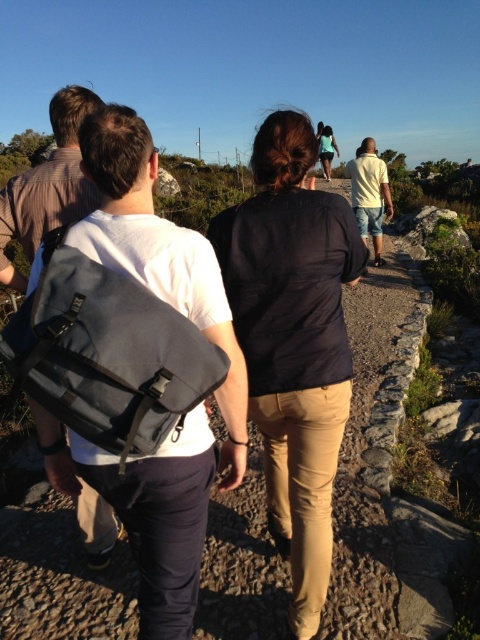
Can you confirm if black fabric shirt at center is positioned below yellow cotton shirt at center?

Correct, black fabric shirt at center is located below yellow cotton shirt at center.

Consider the image. Which of these two, black fabric shirt at center or yellow cotton shirt at center, stands shorter?

Standing shorter between the two is black fabric shirt at center.

Is point (240, 314) less distant than point (381, 230)?

Yes, point (240, 314) is in front of point (381, 230).

I want to click on black fabric shirt at center, so click(294, 340).

Who is more forward, (359, 248) or (147, 172)?

Point (147, 172) is in front.

Measure the distance between point (304, 525) and camera.

Point (304, 525) and camera are 7.26 feet apart from each other.

Identify the location of black fabric shirt at center. The width and height of the screenshot is (480, 640). (294, 340).

Does gray fabric backpack at left lie in front of yellow cotton shirt at center?

Yes.

Does point (237, 484) come farther from viewer compared to point (358, 154)?

No, it is in front of (358, 154).

The image size is (480, 640). Find the location of `gray fabric backpack at left`. gray fabric backpack at left is located at coordinates (158, 253).